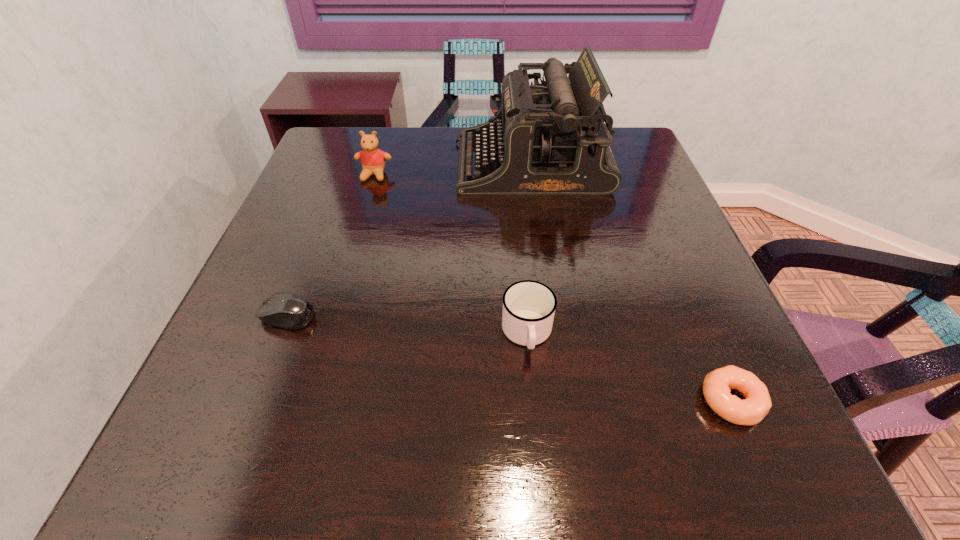
This screenshot has width=960, height=540. In order to click on free point located on the side of the third tallest object with the handle in this screenshot , I will do `click(536, 423)`.

Where is `free space located 0.150m on the back of the mouse`? The image size is (960, 540). free space located 0.150m on the back of the mouse is located at coordinates (313, 249).

In order to click on free spot located 0.360m on the left of the rightmost object in this screenshot , I will do `click(476, 401)`.

Image resolution: width=960 pixels, height=540 pixels. What are the coordinates of `typewriter present at the far edge` in the screenshot? It's located at (550, 138).

The width and height of the screenshot is (960, 540). Identify the location of teddy bear that is at the far edge. (373, 159).

The image size is (960, 540). I want to click on teddy bear that is at the left edge, so click(373, 159).

Image resolution: width=960 pixels, height=540 pixels. What are the coordinates of `mouse situated at the left edge` in the screenshot? It's located at (282, 309).

Image resolution: width=960 pixels, height=540 pixels. In order to click on typewriter positioned at the right edge in this screenshot , I will do `click(550, 138)`.

Identify the location of doughnut situated at the right edge. This screenshot has width=960, height=540. (716, 387).

I want to click on object that is at the far left corner, so click(373, 159).